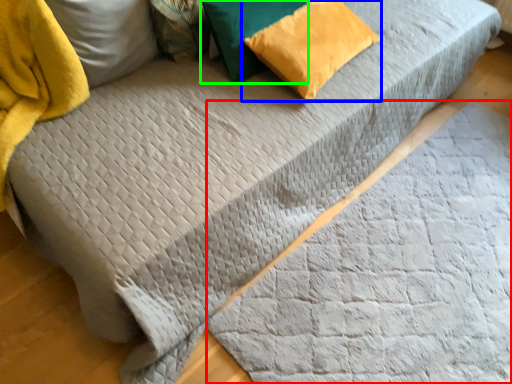
Question: Based on their relative distances, which object is nearer to blanket (highlighted by a red box)? Choose from pillow (highlighted by a blue box) and pillow (highlighted by a green box).

Choices:
 (A) pillow
 (B) pillow

Answer: (A)